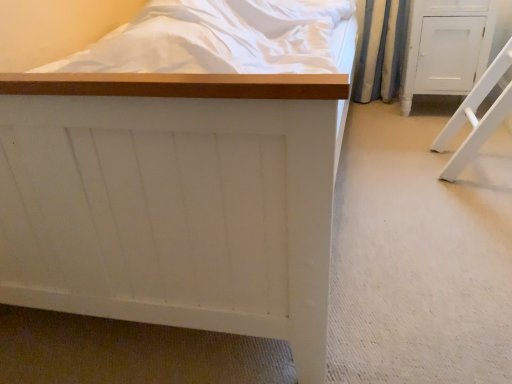
Question: From the image's perspective, relative to white matte bed at center, which is the first furniture from left to right, is white painted wood cabinet at right, the second furniture positioned from the left, above or below?

Choices:
 (A) below
 (B) above

Answer: (B)

Question: Looking at the image, does white painted wood cabinet at right, the second furniture positioned from the left, seem bigger or smaller compared to white matte bed at center, which is the first furniture from left to right?

Choices:
 (A) small
 (B) big

Answer: (A)

Question: Does point (441, 52) appear closer or farther from the camera than point (71, 289)?

Choices:
 (A) closer
 (B) farther

Answer: (B)

Question: From the image's perspective, is white matte bed at center, which appears as the 2th furniture when viewed from the right, above or below white painted wood cabinet at right, the first furniture when ordered from right to left?

Choices:
 (A) above
 (B) below

Answer: (B)

Question: From their relative heights in the image, would you say white matte bed at center, which is the first furniture from left to right, is taller or shorter than white painted wood cabinet at right, the first furniture when ordered from right to left?

Choices:
 (A) tall
 (B) short

Answer: (A)

Question: Relative to white painted wood cabinet at right, the second furniture positioned from the left, is white matte bed at center, which is the first furniture from left to right, in front or behind?

Choices:
 (A) front
 (B) behind

Answer: (A)

Question: Is white matte bed at center, which appears as the 2th furniture when viewed from the right, inside the boundaries of white painted wood cabinet at right, the second furniture positioned from the left, or outside?

Choices:
 (A) outside
 (B) inside

Answer: (A)